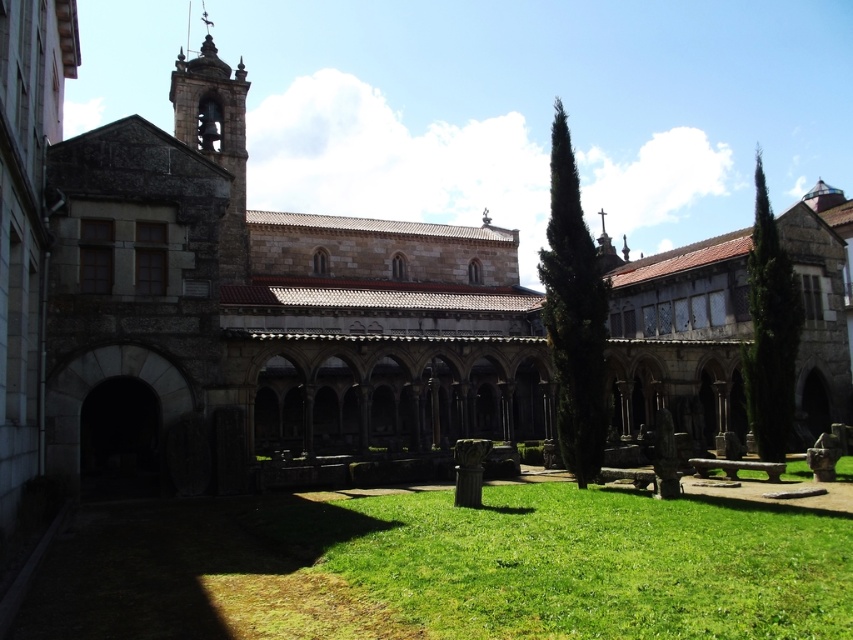
Who is positioned more to the left, green grass at lower center or stone bell tower at upper left?

Positioned to the left is stone bell tower at upper left.

Between point (640, 598) and point (207, 109), which one is positioned behind?

The point (207, 109) is more distant.

Does point (712, 515) lie in front of point (225, 228)?

Yes, point (712, 515) is in front of point (225, 228).

You are a GUI agent. You are given a task and a screenshot of the screen. Output one action in this format:
    pyautogui.click(x=<x>, y=<y>)
    Task: Click on the green grass at lower center
    The width and height of the screenshot is (853, 640).
    Given the screenshot: What is the action you would take?
    pyautogui.click(x=445, y=568)